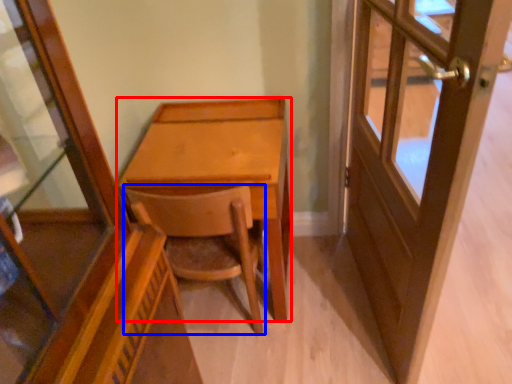
Question: Which object appears closest to the camera in this image, desk (highlighted by a red box) or chair (highlighted by a blue box)?

Choices:
 (A) desk
 (B) chair

Answer: (B)